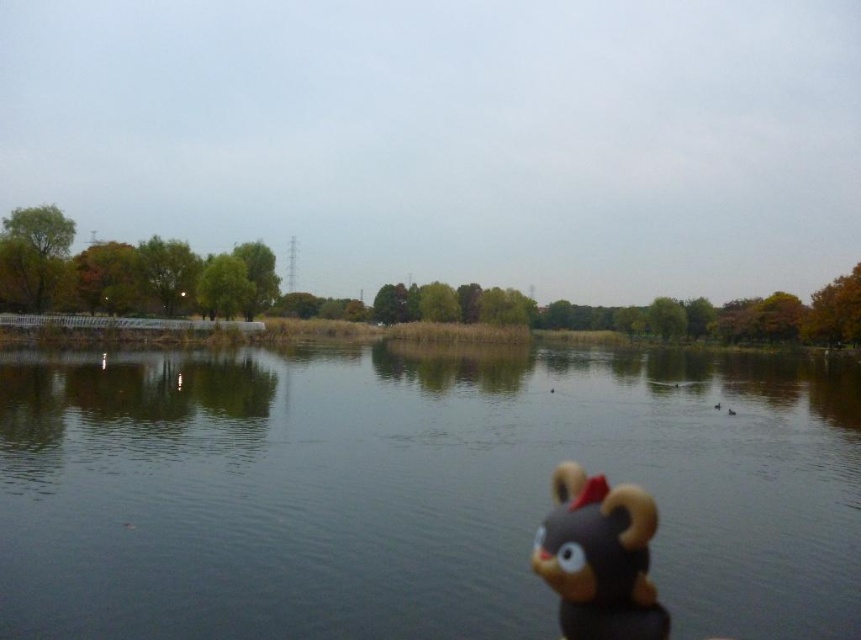
Question: Which of the following is the closest to the observer?

Choices:
 (A) brown matte plush toy at lower right
 (B) transparent water at center

Answer: (A)

Question: Considering the relative positions of transparent water at center and brown matte plush toy at lower right in the image provided, where is transparent water at center located with respect to brown matte plush toy at lower right?

Choices:
 (A) left
 (B) right

Answer: (A)

Question: Among these objects, which one is nearest to the camera?

Choices:
 (A) brown matte plush toy at lower right
 (B) transparent water at center

Answer: (A)

Question: Can you confirm if transparent water at center is wider than brown matte plush toy at lower right?

Choices:
 (A) yes
 (B) no

Answer: (A)

Question: Considering the relative positions of transparent water at center and brown matte plush toy at lower right in the image provided, where is transparent water at center located with respect to brown matte plush toy at lower right?

Choices:
 (A) above
 (B) below

Answer: (B)